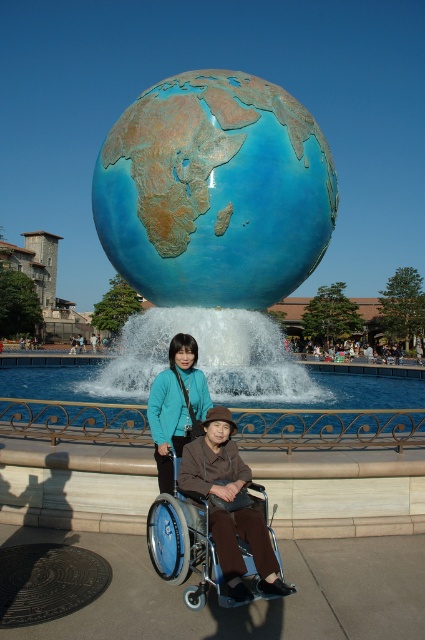
You are a maintenance worker needing to reach the blue polished globe at center from the blue metallic wheelchair at lower center. The wheelchair has a maximum range of 10 meters. Can you reach the globe without getting out of the wheelchair?

The distance between the blue polished globe at center and the blue metallic wheelchair at lower center is 12.70 meters, which exceeds the wheelchair maximum range of 10 meters. Therefore, you cannot reach the globe without getting out of the wheelchair.

You are a visitor at the sculpture garden and want to take a photo of the blue polished globe at center and the matte teal jacket at center. Which object should you focus on first if you want to include both in the frame without moving the camera?

The blue polished globe at center is wider than the matte teal jacket at center, so you should focus on the blue polished globe at center first to ensure it fits in the frame.